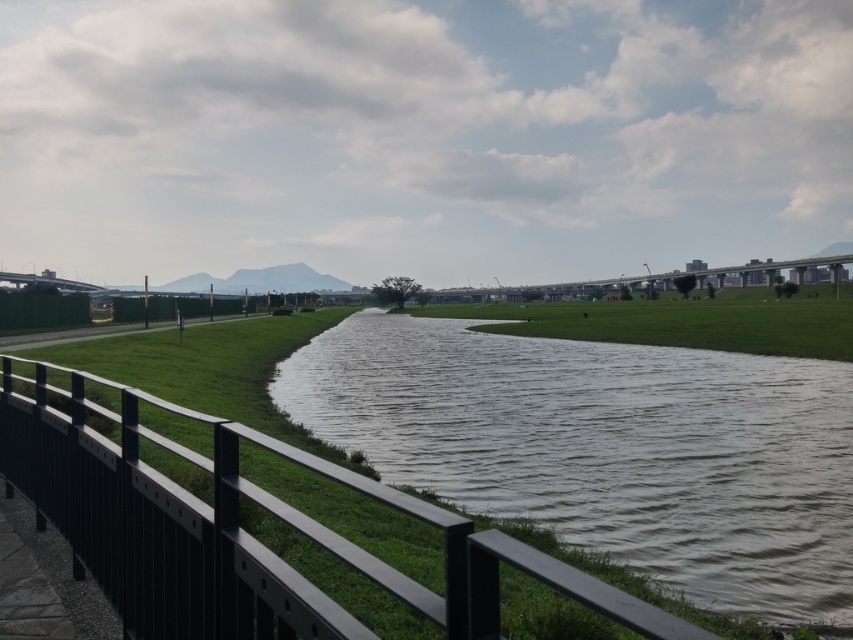
Which is behind, point (587, 589) or point (573, 337)?

The point (573, 337) is more distant.

Can you confirm if black metal rail at center is positioned above green grass at center?

No.

Does point (260, 502) lie behind point (730, 301)?

That is False.

You are a GUI agent. You are given a task and a screenshot of the screen. Output one action in this format:
    pyautogui.click(x=<x>, y=<y>)
    Task: Click on the black metal rail at center
    The width and height of the screenshot is (853, 640).
    Given the screenshot: What is the action you would take?
    pyautogui.click(x=242, y=531)

Which is more to the right, brown matte water at center or black metal rail at center?

brown matte water at center

Is point (685, 436) less distant than point (155, 529)?

No, (685, 436) is behind (155, 529).

Locate an element on the screen. This screenshot has height=640, width=853. brown matte water at center is located at coordinates (608, 449).

Between brown matte water at center and green grass at center, which one is positioned lower?

brown matte water at center

Can you confirm if brown matte water at center is wider than green grass at center?

In fact, brown matte water at center might be narrower than green grass at center.

You are a GUI agent. You are given a task and a screenshot of the screen. Output one action in this format:
    pyautogui.click(x=<x>, y=<y>)
    Task: Click on the brown matte water at center
    
    Given the screenshot: What is the action you would take?
    pyautogui.click(x=608, y=449)